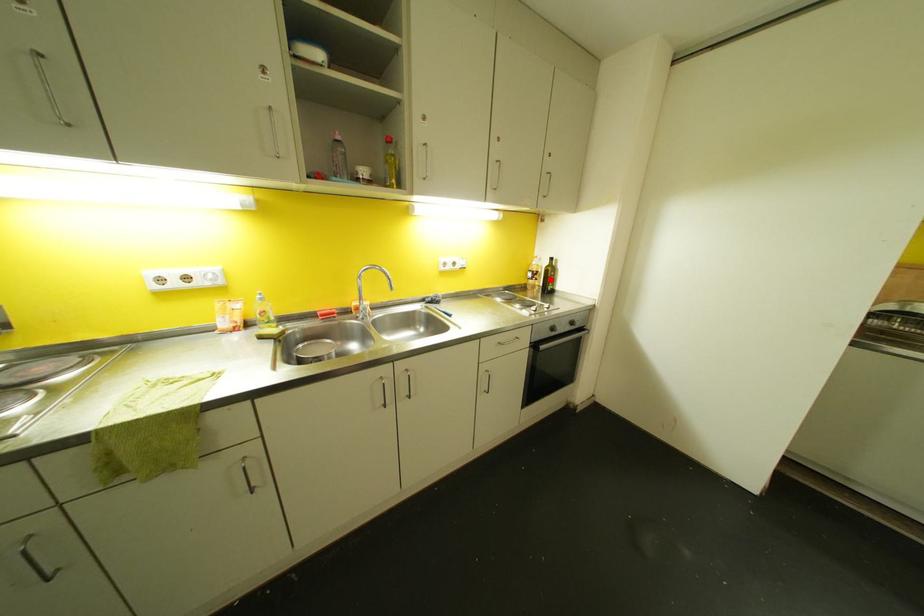
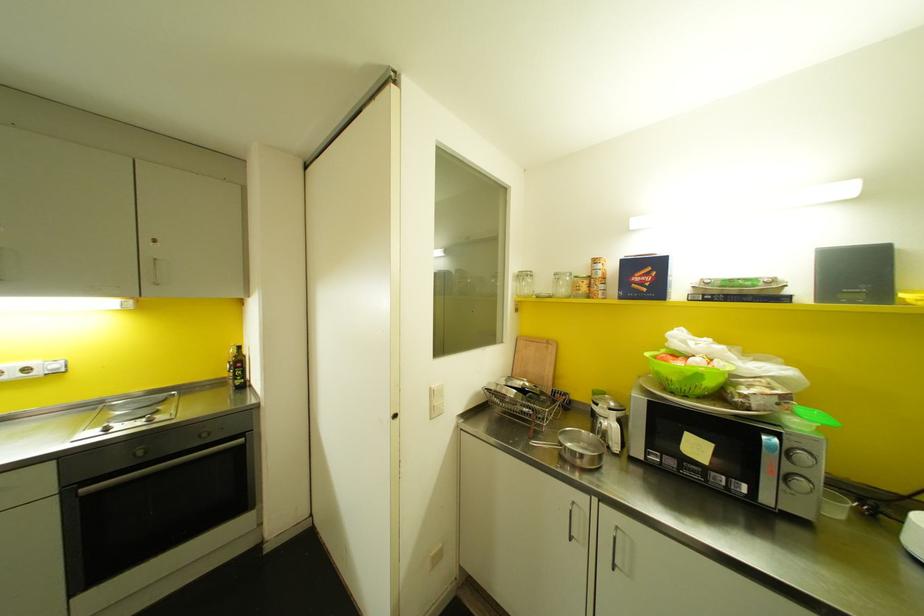
Locate, in the second image, the point that corresponds to the highlighted location in the first image.

(237, 371)